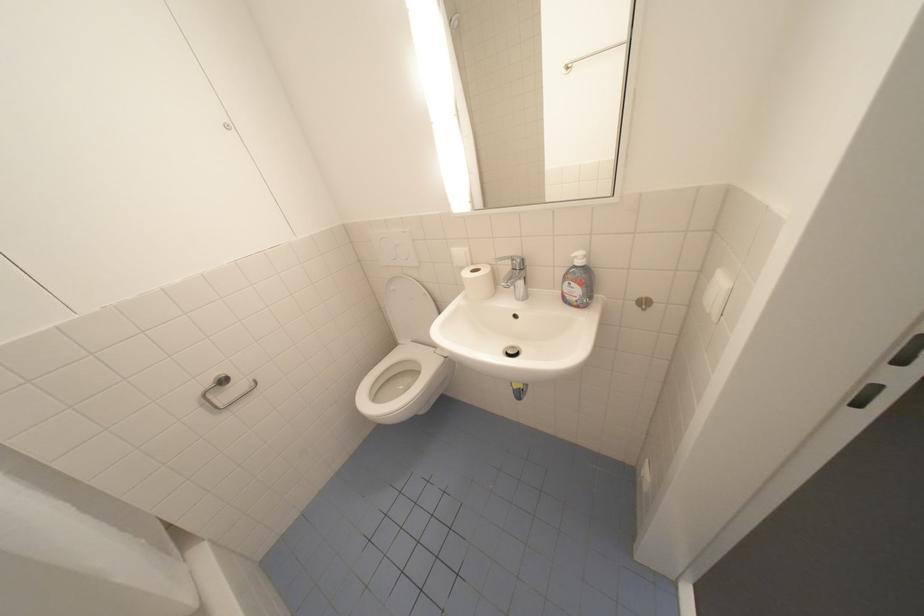
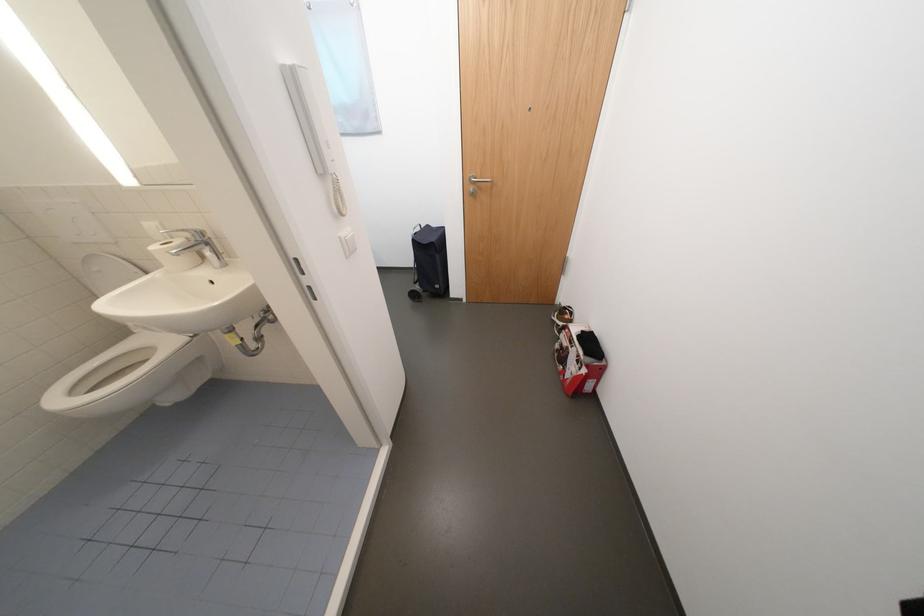
Question: How did the camera likely rotate?

Choices:
 (A) Left
 (B) Right
 (C) Up
 (D) Down

Answer: (B)